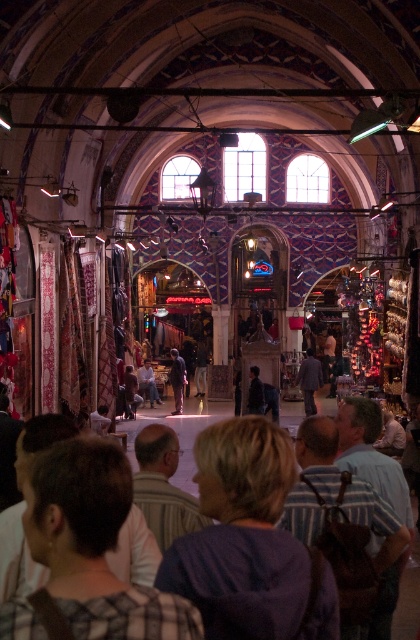
Question: Estimate the real-world distances between objects in this image. Which object is farther from the dark blue jeans at center?

Choices:
 (A) purple fabric at center
 (B) brown leather backpack at center
 (C) plaid fabric shirt at lower center

Answer: (C)

Question: Can you confirm if purple fabric at center is positioned above brown leather backpack at center?

Choices:
 (A) yes
 (B) no

Answer: (A)

Question: Is purple fabric at center further to the viewer compared to plaid fabric shirt at lower center?

Choices:
 (A) no
 (B) yes

Answer: (B)

Question: Which point is farther to the camera?

Choices:
 (A) (128, 474)
 (B) (252, 557)
 (C) (306, 506)
 (D) (125, 387)

Answer: (D)

Question: Which object is the closest to the dark blue jeans at center?

Choices:
 (A) plaid fabric shirt at lower center
 (B) purple fabric at center

Answer: (B)

Question: From the image, what is the correct spatial relationship of brown leather backpack at center in relation to dark blue jeans at center?

Choices:
 (A) right
 (B) left

Answer: (A)